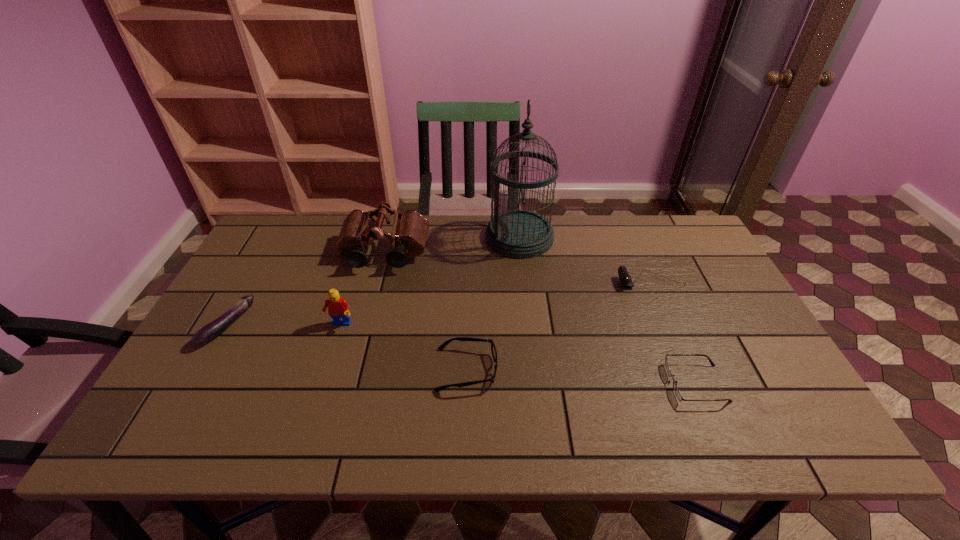
Locate an element on the screen. This screenshot has height=540, width=960. vacant space located 0.100m on the front-facing side of the tallest object is located at coordinates (455, 237).

Identify the location of vacant region located through the eyepieces of the binoculars. The height and width of the screenshot is (540, 960). (360, 350).

The height and width of the screenshot is (540, 960). Find the location of `free point located 0.190m on the front-facing side of the Lego`. free point located 0.190m on the front-facing side of the Lego is located at coordinates (318, 393).

In order to click on blank space located 0.300m on the front-facing side of the webcam in this screenshot , I will do `click(516, 281)`.

Where is `blank space located 0.310m on the front-facing side of the webcam`? The width and height of the screenshot is (960, 540). blank space located 0.310m on the front-facing side of the webcam is located at coordinates (512, 281).

This screenshot has width=960, height=540. I want to click on vacant region located 0.380m on the front-facing side of the webcam, so click(489, 281).

At what (x,y) coordinates should I click in order to perform the action: click on vacant position located on the right of the eggplant. Please return your answer as a coordinate pair (x, y). This screenshot has height=540, width=960. Looking at the image, I should click on (349, 326).

Find the location of a particular element. This screenshot has width=960, height=540. vacant space located on the front-facing side of the taller spectacles is located at coordinates (547, 369).

The image size is (960, 540). Identify the location of blank space located 0.320m on the front-facing side of the right spectacles. (532, 383).

The width and height of the screenshot is (960, 540). Find the location of `vacant space positioned 0.090m on the front-facing side of the right spectacles`. vacant space positioned 0.090m on the front-facing side of the right spectacles is located at coordinates (630, 383).